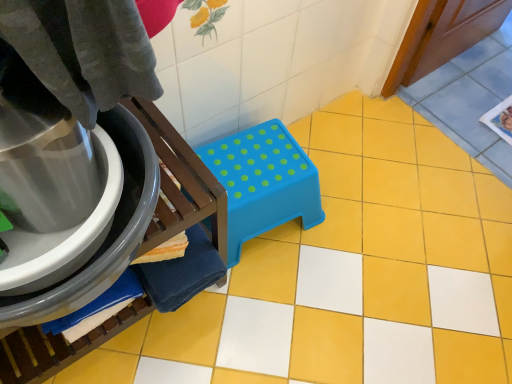
The image size is (512, 384). Find the location of `empty space that is ontop of blue plastic step stool at center (from a real-world perspective)`. empty space that is ontop of blue plastic step stool at center (from a real-world perspective) is located at coordinates (256, 163).